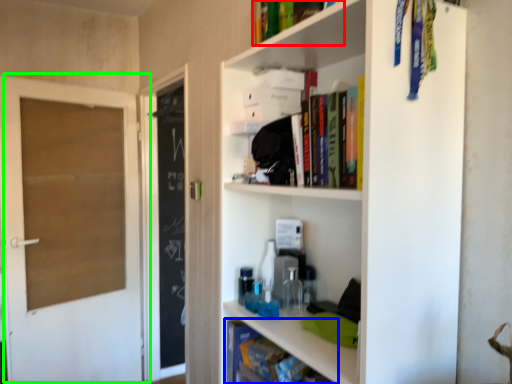
Question: Which object is the farthest from book (highlighted by a red box)? Choose among these: book (highlighted by a blue box) or door (highlighted by a green box).

Choices:
 (A) book
 (B) door

Answer: (B)